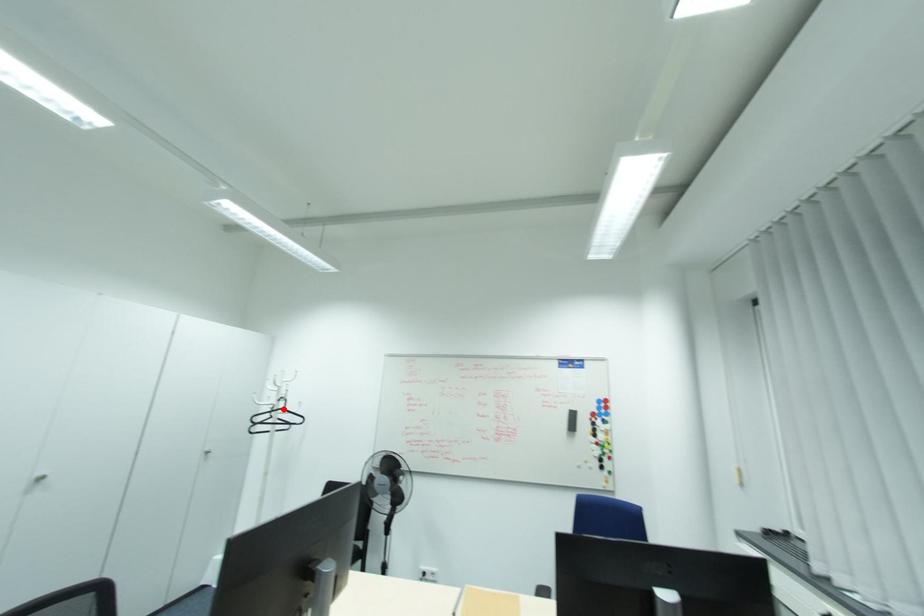
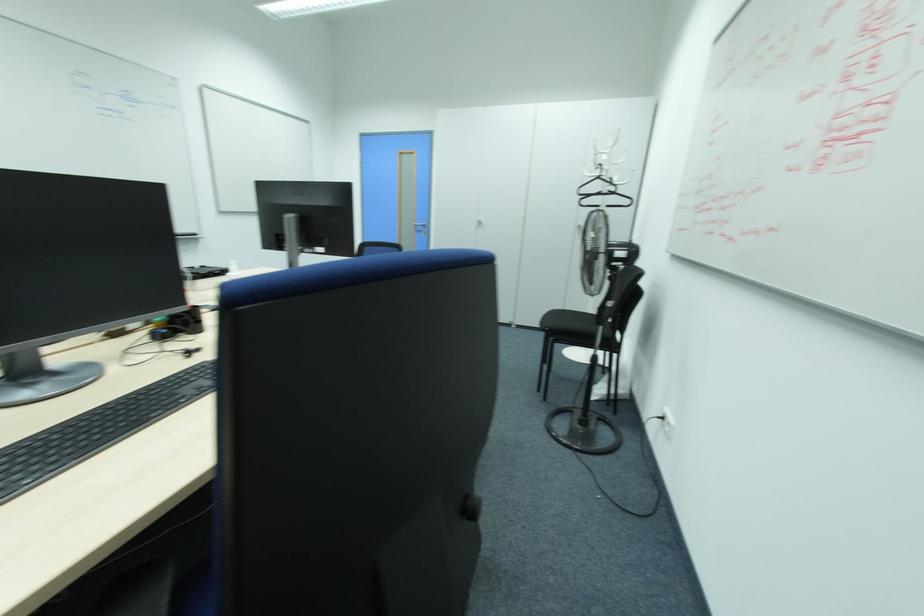
Question: I am providing you with two images of the same scene from different viewpoints. A red point is shown in image1. For the corresponding object point in image2, is it positioned nearer or farther from the camera?

Choices:
 (A) Nearer
 (B) Farther

Answer: (A)